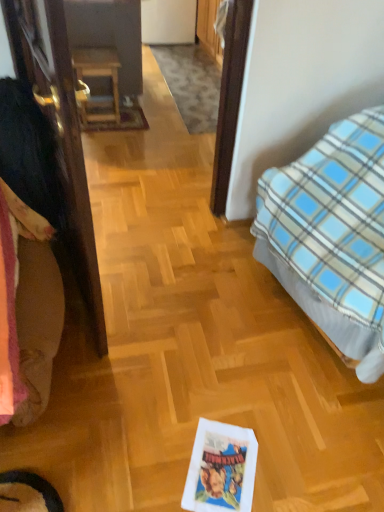
Question: Is brown wooden door at left bigger than blue plaid blanket at right?

Choices:
 (A) yes
 (B) no

Answer: (B)

Question: Is brown wooden door at left aimed at blue plaid blanket at right?

Choices:
 (A) yes
 (B) no

Answer: (A)

Question: Is brown wooden door at left placed right next to blue plaid blanket at right?

Choices:
 (A) no
 (B) yes

Answer: (A)

Question: From the image's perspective, does brown wooden door at left appear higher than blue plaid blanket at right?

Choices:
 (A) yes
 (B) no

Answer: (A)

Question: From a real-world perspective, is brown wooden door at left on blue plaid blanket at right?

Choices:
 (A) yes
 (B) no

Answer: (A)

Question: Is brown wooden door at left not close to blue plaid blanket at right?

Choices:
 (A) yes
 (B) no

Answer: (B)

Question: Considering the relative sizes of fluffy beige blanket at left and blue plaid blanket at right in the image provided, is fluffy beige blanket at left taller than blue plaid blanket at right?

Choices:
 (A) no
 (B) yes

Answer: (A)

Question: Considering the relative sizes of fluffy beige blanket at left and blue plaid blanket at right in the image provided, is fluffy beige blanket at left bigger than blue plaid blanket at right?

Choices:
 (A) no
 (B) yes

Answer: (A)

Question: Considering the relative positions of fluffy beige blanket at left and blue plaid blanket at right in the image provided, is fluffy beige blanket at left in front of blue plaid blanket at right?

Choices:
 (A) yes
 (B) no

Answer: (B)

Question: Are fluffy beige blanket at left and blue plaid blanket at right far apart?

Choices:
 (A) yes
 (B) no

Answer: (A)

Question: From the image's perspective, is fluffy beige blanket at left above blue plaid blanket at right?

Choices:
 (A) no
 (B) yes

Answer: (A)

Question: Can you confirm if fluffy beige blanket at left is positioned to the right of blue plaid blanket at right?

Choices:
 (A) yes
 (B) no

Answer: (B)

Question: Could you tell me if wooden table at center is turned towards fluffy beige blanket at left?

Choices:
 (A) no
 (B) yes

Answer: (B)